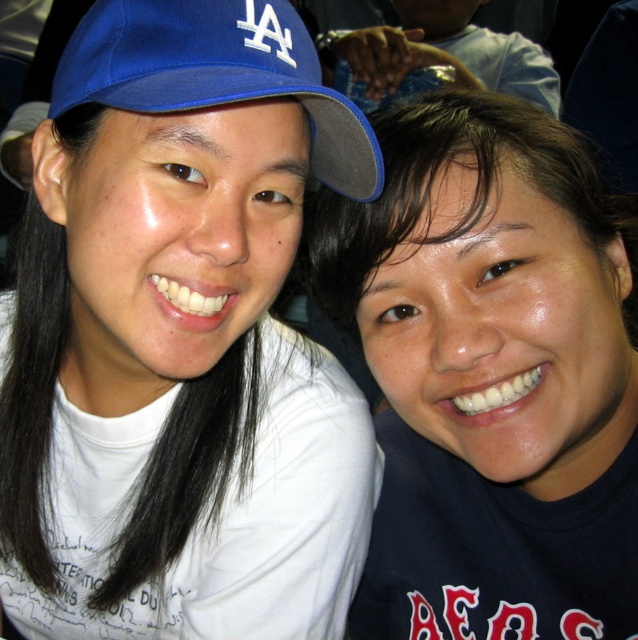
Question: Can you confirm if matte black shirt at center is positioned above blue fabric cap at left?

Choices:
 (A) yes
 (B) no

Answer: (B)

Question: Does matte black shirt at center have a lesser width compared to blue fabric cap at left?

Choices:
 (A) no
 (B) yes

Answer: (A)

Question: Which is nearer to the matte white shirt at center?

Choices:
 (A) blue fabric cap at left
 (B) matte black shirt at center

Answer: (B)

Question: Is matte white shirt at center to the right of blue fabric cap at left from the viewer's perspective?

Choices:
 (A) yes
 (B) no

Answer: (B)

Question: Which point is farther to the camera?

Choices:
 (A) (276, 596)
 (B) (114, 106)

Answer: (A)

Question: Among these points, which one is farthest from the camera?

Choices:
 (A) (595, 214)
 (B) (276, 448)

Answer: (B)